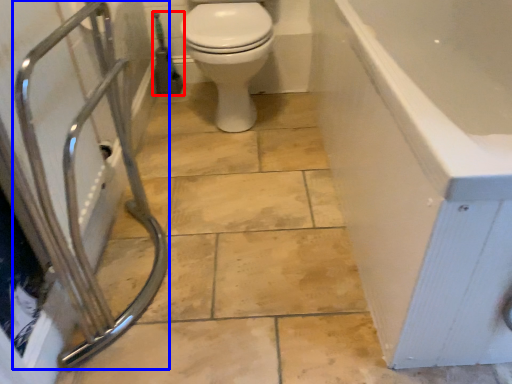
Question: Among these objects, which one is nearest to the camera, garden hose (highlighted by a red box) or shower (highlighted by a blue box)?

Choices:
 (A) garden hose
 (B) shower

Answer: (B)